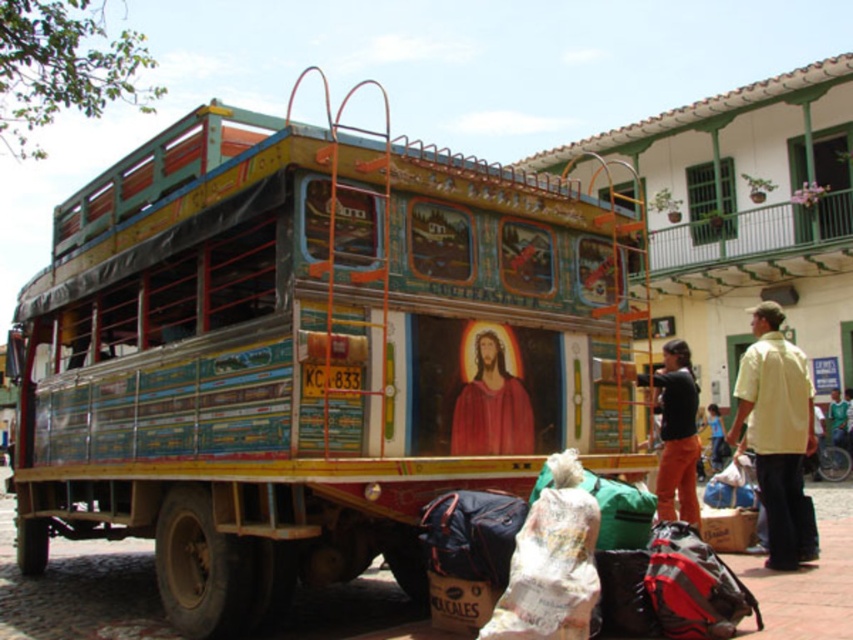
You are a delivery person who needs to load a tall package onto the flatbed of the bus. You see the painted wood food truck at center and the orange pants at center. Which object is taller and can help you determine if the package will fit?

The painted wood food truck at center is much taller than the orange pants at center, so if the package is taller than the orange pants at center, it might not fit under the painted wood food truck at center.

You are a food vendor who wants to set up a stall on the flatbed of the bus. You have a painted wood food truck at center and orange pants at center. Which object should you place first to maximize space utilization?

The painted wood food truck at center is bigger than orange pants at center, so you should place the painted wood food truck at center first to maximize space utilization.